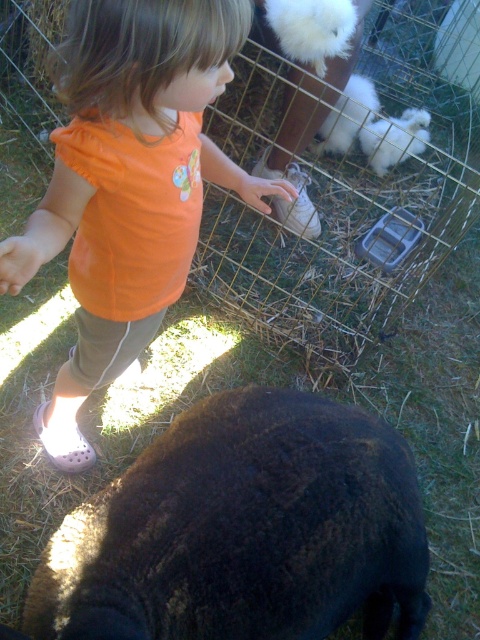
Does black woolen sheep at lower left have a smaller size compared to orange cotton shirt at center?

Indeed, black woolen sheep at lower left has a smaller size compared to orange cotton shirt at center.

This screenshot has width=480, height=640. What are the coordinates of `black woolen sheep at lower left` in the screenshot? It's located at (243, 531).

Is point (162, 497) positioned in front of point (181, 97)?

No, it is not.

This screenshot has width=480, height=640. Identify the location of black woolen sheep at lower left. (243, 531).